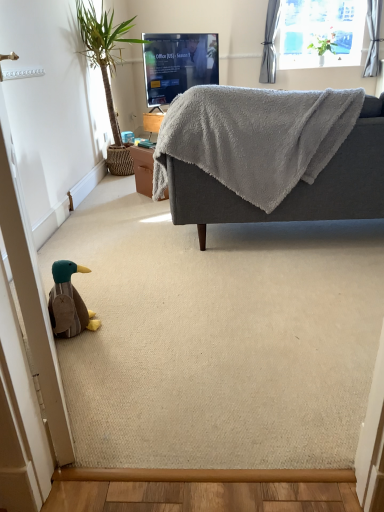
Where is `vacant space that is in between green leafy plant at left and brown plush duck at lower left`? vacant space that is in between green leafy plant at left and brown plush duck at lower left is located at coordinates (111, 224).